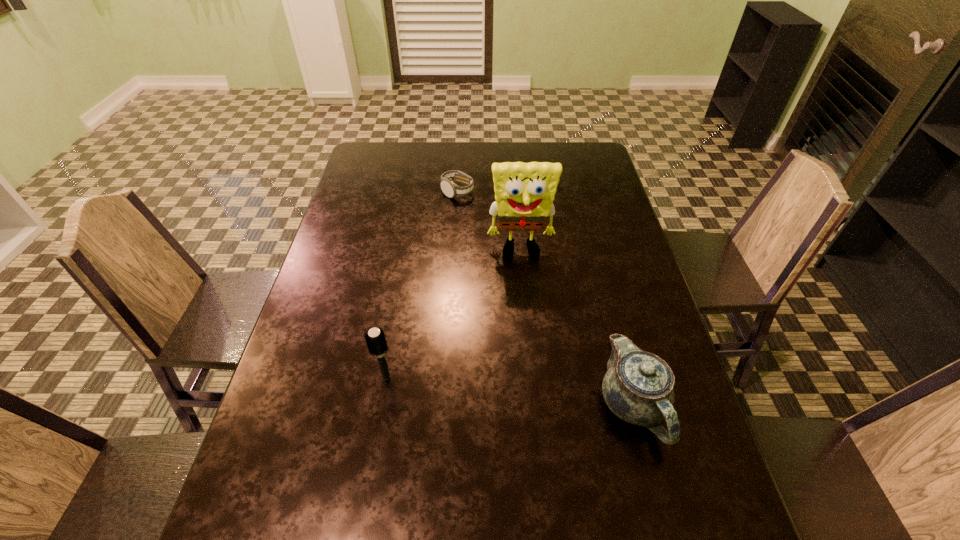
This screenshot has width=960, height=540. Find the location of `vacant space at the near left corner`. vacant space at the near left corner is located at coordinates (264, 471).

This screenshot has height=540, width=960. What are the coordinates of `free spot between the watch and the leftmost object` in the screenshot? It's located at (421, 284).

Find the location of a particular element. The width and height of the screenshot is (960, 540). free space between the tallest object and the second shortest object is located at coordinates (577, 328).

Find the location of a particular element. free point between the farthest object and the chinaware is located at coordinates (545, 298).

Identify the location of blank region between the rightmost object and the third object from right to left. The height and width of the screenshot is (540, 960). (545, 298).

Locate an element on the screen. The image size is (960, 540). free area in between the leftmost object and the third object from right to left is located at coordinates (421, 284).

Locate an element on the screen. vacant area that lies between the watch and the sponge is located at coordinates (490, 222).

Locate an element on the screen. vacant point located between the watch and the third tallest object is located at coordinates (545, 298).

Identify the location of vacant space that is in between the rightmost object and the second farthest object. (577, 328).

Locate an element on the screen. This screenshot has width=960, height=540. vacant area that lies between the shortest object and the tallest object is located at coordinates (490, 222).